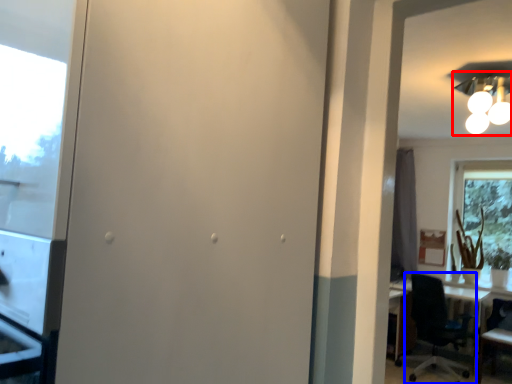
Question: Which point is further to the camera, light fixture (highlighted by a red box) or chair (highlighted by a blue box)?

Choices:
 (A) light fixture
 (B) chair

Answer: (B)